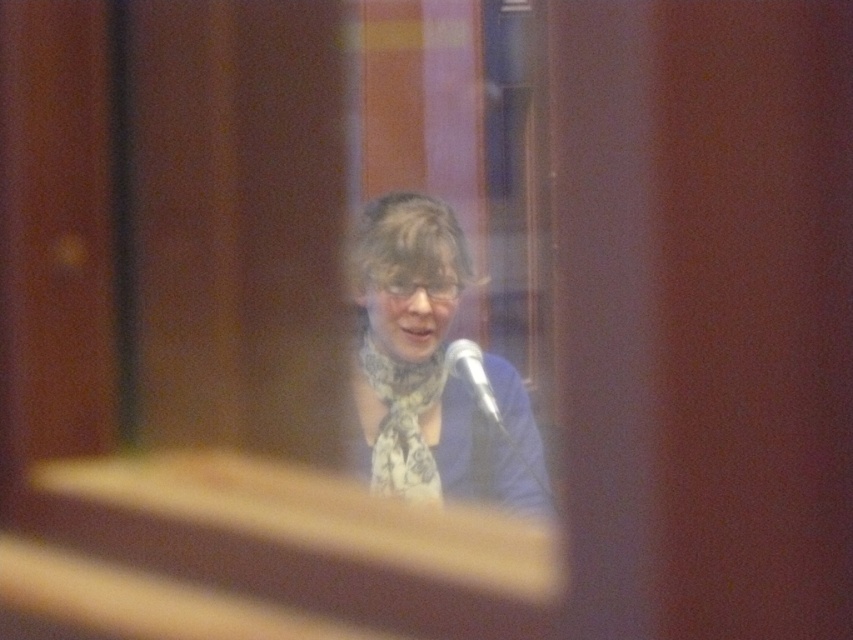
Between white printed scarf at center and silver metallic microphone at center, which one has less height?

With less height is silver metallic microphone at center.

Between point (437, 348) and point (461, 339), which one is positioned behind?

Point (461, 339)

Identify the location of white printed scarf at center. (433, 369).